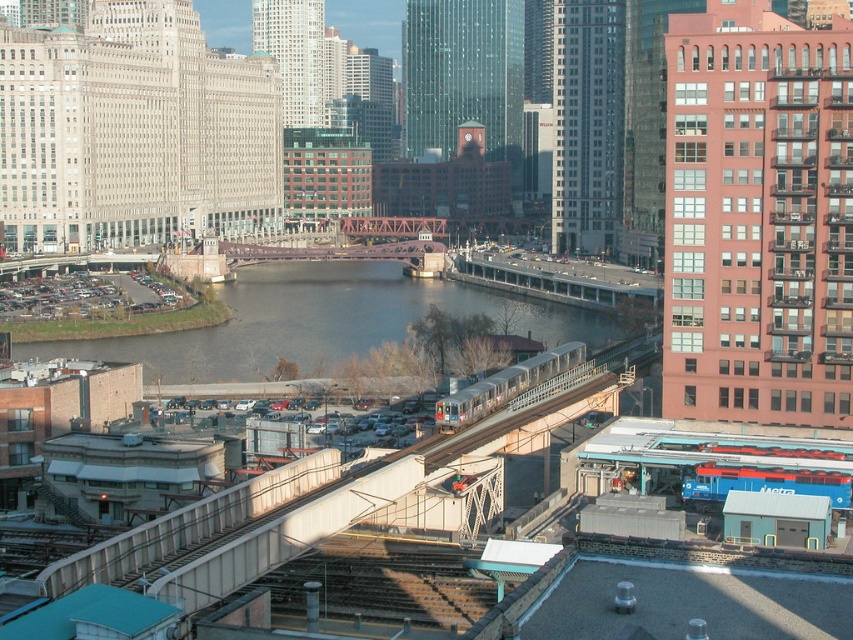
Question: Among these points, which one is farthest from the camera?

Choices:
 (A) tap(526, 374)
 (B) tap(431, 292)

Answer: (B)

Question: Can you confirm if dark gray concrete waterway at center is thinner than silver metallic train at center?

Choices:
 (A) no
 (B) yes

Answer: (A)

Question: Which point appears closest to the camera in this image?

Choices:
 (A) (x=316, y=356)
 (B) (x=473, y=408)

Answer: (B)

Question: Which point is closer to the camera?

Choices:
 (A) (338, 339)
 (B) (498, 381)

Answer: (B)

Question: In this image, where is dark gray concrete waterway at center located relative to silver metallic train at center?

Choices:
 (A) right
 (B) left

Answer: (B)

Question: Can you confirm if dark gray concrete waterway at center is smaller than silver metallic train at center?

Choices:
 (A) no
 (B) yes

Answer: (A)